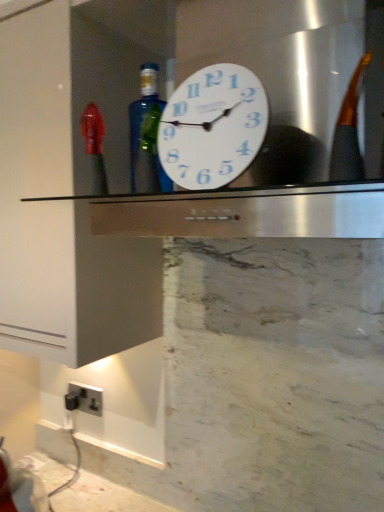
What do you see at coordinates (213, 127) in the screenshot? I see `white plastic clock at center` at bounding box center [213, 127].

I want to click on satin silver plug socket at lower left, so click(84, 399).

How different are the orientations of white plastic clock at center and satin silver plug socket at lower left in degrees?

The angular difference between white plastic clock at center and satin silver plug socket at lower left is 14.1 degrees.

From a real-world perspective, which object stands above the other?

white plastic clock at center is physically above.

Considering the relative sizes of white plastic clock at center and satin silver plug socket at lower left in the image provided, is white plastic clock at center bigger than satin silver plug socket at lower left?

Indeed, white plastic clock at center has a larger size compared to satin silver plug socket at lower left.

Considering the positions of objects blue glass bottle at center and satin silver plug socket at lower left in the image provided, who is behind, blue glass bottle at center or satin silver plug socket at lower left?

satin silver plug socket at lower left is more distant.

Based on the photo, considering the sizes of objects blue glass bottle at center and satin silver plug socket at lower left in the image provided, who is smaller, blue glass bottle at center or satin silver plug socket at lower left?

satin silver plug socket at lower left.

Is blue glass bottle at center turned away from satin silver plug socket at lower left?

blue glass bottle at center is not turned away from satin silver plug socket at lower left.

Does point (146, 98) come farther from viewer compared to point (81, 399)?

No, it is in front of (81, 399).

Would you say satin silver plug socket at lower left is to the left or to the right of white plastic clock at center in the picture?

From the image, it's evident that satin silver plug socket at lower left is to the left of white plastic clock at center.

Is satin silver plug socket at lower left looking in the opposite direction of white plastic clock at center?

satin silver plug socket at lower left does not have its back to white plastic clock at center.

Is satin silver plug socket at lower left next to white plastic clock at center and touching it?

No, satin silver plug socket at lower left is not next to white plastic clock at center.

Can you tell me how much satin silver plug socket at lower left and white plastic clock at center differ in facing direction?

satin silver plug socket at lower left and white plastic clock at center are facing 14.1 degrees away from each other.

From a real-world perspective, which object stands above the other?

From a 3D spatial view, blue glass bottle at center is above.

Is the depth of satin silver plug socket at lower left less than that of blue glass bottle at center?

No, satin silver plug socket at lower left is further to the viewer.

Is satin silver plug socket at lower left facing away from blue glass bottle at center?

That's not correct — satin silver plug socket at lower left is not looking away from blue glass bottle at center.

Is blue glass bottle at center thinner than white plastic clock at center?

Incorrect, the width of blue glass bottle at center is not less than that of white plastic clock at center.

Does blue glass bottle at center have a larger size compared to white plastic clock at center?

No, blue glass bottle at center is not bigger than white plastic clock at center.

Considering the relative sizes of blue glass bottle at center and white plastic clock at center in the image provided, is blue glass bottle at center taller than white plastic clock at center?

No.

Which is less distant, (234, 144) or (149, 137)?

Point (234, 144) is closer to the camera than point (149, 137).

Can you confirm if white plastic clock at center is thinner than blue glass bottle at center?

Yes, white plastic clock at center is thinner than blue glass bottle at center.

At what (x,y) coordinates should I click in order to perform the action: click on wall clock that is in front of the blue glass bottle at center. Please return your answer as a coordinate pair (x, y). This screenshot has height=512, width=384. Looking at the image, I should click on (213, 127).

Is white plastic clock at center in contact with blue glass bottle at center?

No, white plastic clock at center is not next to blue glass bottle at center.

The width and height of the screenshot is (384, 512). I want to click on wall clock on the right of satin silver plug socket at lower left, so (213, 127).

Find the location of a particular element. This screenshot has height=512, width=384. electric outlet to the left of blue glass bottle at center is located at coordinates (84, 399).

Which object lies nearer to the anchor point white plastic clock at center, satin silver plug socket at lower left or blue glass bottle at center?

blue glass bottle at center is positioned closer to the anchor white plastic clock at center.

Which object lies nearer to the anchor point white plastic clock at center, blue glass bottle at center or satin silver plug socket at lower left?

blue glass bottle at center.

Looking at the image, which one is located closer to blue glass bottle at center, satin silver plug socket at lower left or white plastic clock at center?

white plastic clock at center.

Based on their spatial positions, is white plastic clock at center or satin silver plug socket at lower left closer to blue glass bottle at center?

The object closer to blue glass bottle at center is white plastic clock at center.

Based on their spatial positions, is blue glass bottle at center or white plastic clock at center further from satin silver plug socket at lower left?

The object further to satin silver plug socket at lower left is white plastic clock at center.

Estimate the real-world distances between objects in this image. Which object is closer to satin silver plug socket at lower left, white plastic clock at center or blue glass bottle at center?

blue glass bottle at center is positioned closer to the anchor satin silver plug socket at lower left.

Where is `bottle between white plastic clock at center and satin silver plug socket at lower left along the z-axis`? The width and height of the screenshot is (384, 512). bottle between white plastic clock at center and satin silver plug socket at lower left along the z-axis is located at coordinates (147, 136).